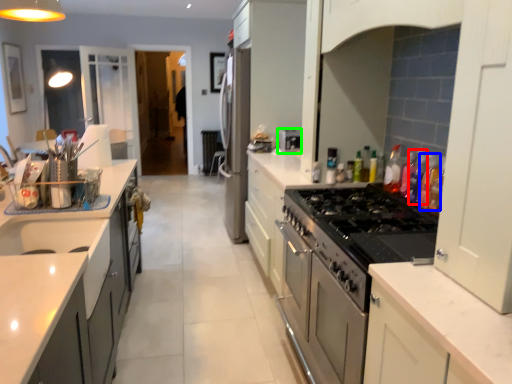
Question: Estimate the real-world distances between objects in this image. Which object is farther from bottle (highlighted by a red box), bottle (highlighted by a blue box) or appliance (highlighted by a green box)?

Choices:
 (A) bottle
 (B) appliance

Answer: (B)